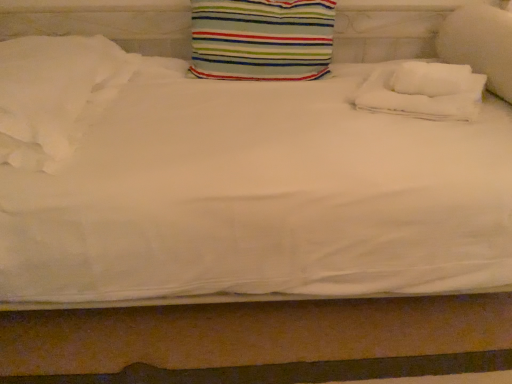
At what (x,y) coordinates should I click in order to perform the action: click on striped fabric pillow at center, positioned as the third pillow in right-to-left order. Please return your answer as a coordinate pair (x, y). This screenshot has height=384, width=512. Looking at the image, I should click on (x=261, y=39).

The image size is (512, 384). What do you see at coordinates (55, 95) in the screenshot?
I see `white soft pillow at left, placed as the 1th pillow when sorted from left to right` at bounding box center [55, 95].

At what (x,y) coordinates should I click in order to perform the action: click on white soft towel at upper right, the 3th pillow when ordered from left to right. Please return your answer as a coordinate pair (x, y). Looking at the image, I should click on (423, 91).

What is the approximate height of white soft pillow at right, which is the 1th pillow in right-to-left order?

It is 11.79 inches.

This screenshot has width=512, height=384. In order to click on white soft pillow at right, which is the 1th pillow in right-to-left order in this screenshot , I will do `click(480, 44)`.

I want to click on striped fabric pillow at center, the second pillow positioned from the left, so click(x=261, y=39).

Is white soft pillow at right, which is the 1th pillow in right-to-left order, positioned far away from striped fabric pillow at center, positioned as the third pillow in right-to-left order?

That's not correct — white soft pillow at right, which is the 1th pillow in right-to-left order, is a little close to striped fabric pillow at center, positioned as the third pillow in right-to-left order.

Can you confirm if white soft pillow at right, which is the 1th pillow in right-to-left order, is taller than striped fabric pillow at center, positioned as the third pillow in right-to-left order?

Indeed, white soft pillow at right, which is the 1th pillow in right-to-left order, has a greater height compared to striped fabric pillow at center, positioned as the third pillow in right-to-left order.

There is a striped fabric pillow at center, the second pillow positioned from the left. Identify the location of the 1st pillow below it (from the image's perspective). The image size is (512, 384). (480, 44).

Can you confirm if white soft pillow at right, which is the 1th pillow in right-to-left order, is bigger than striped fabric pillow at center, positioned as the third pillow in right-to-left order?

Yes, white soft pillow at right, which is the 1th pillow in right-to-left order, is bigger than striped fabric pillow at center, positioned as the third pillow in right-to-left order.

From a real-world perspective, relative to white soft towel at upper right, the 3th pillow when ordered from left to right, is white soft pillow at left, which is the fourth pillow in right-to-left order, vertically above or below?

white soft pillow at left, which is the fourth pillow in right-to-left order, is situated higher than white soft towel at upper right, the 3th pillow when ordered from left to right, in the real world.

What's the angular difference between white soft pillow at left, placed as the 1th pillow when sorted from left to right, and white soft towel at upper right, the 3th pillow when ordered from left to right,'s facing directions?

The angle between the facing direction of white soft pillow at left, placed as the 1th pillow when sorted from left to right, and the facing direction of white soft towel at upper right, the 3th pillow when ordered from left to right, is 8.18e-05 degrees.

Image resolution: width=512 pixels, height=384 pixels. I want to click on the 2nd pillow in front of the white soft towel at upper right, marked as the second pillow in a right-to-left arrangement, so click(x=55, y=95).

Does white soft pillow at left, which is the fourth pillow in right-to-left order, turn towards white soft towel at upper right, the 3th pillow when ordered from left to right?

No.

Is white soft towel at upper right, the 3th pillow when ordered from left to right, turned away from white soft pillow at right, which is the 1th pillow in right-to-left order?

No, white soft towel at upper right, the 3th pillow when ordered from left to right, is not facing the opposite direction of white soft pillow at right, which is the 1th pillow in right-to-left order.

Which of these two, white soft towel at upper right, marked as the second pillow in a right-to-left arrangement, or white soft pillow at right, which is the 1th pillow in right-to-left order, is wider?

With larger width is white soft pillow at right, which is the 1th pillow in right-to-left order.

Considering the positions of objects white soft towel at upper right, marked as the second pillow in a right-to-left arrangement, and white soft pillow at right, placed as the 4th pillow when sorted from left to right, in the image provided, who is behind, white soft towel at upper right, marked as the second pillow in a right-to-left arrangement, or white soft pillow at right, placed as the 4th pillow when sorted from left to right,?

white soft towel at upper right, marked as the second pillow in a right-to-left arrangement.

Is point (475, 97) positioned in front of point (448, 49)?

Yes, point (475, 97) is closer to viewer.

Considering the sizes of objects striped fabric pillow at center, positioned as the third pillow in right-to-left order, and white soft towel at upper right, marked as the second pillow in a right-to-left arrangement, in the image provided, who is thinner, striped fabric pillow at center, positioned as the third pillow in right-to-left order, or white soft towel at upper right, marked as the second pillow in a right-to-left arrangement,?

Thinner between the two is striped fabric pillow at center, positioned as the third pillow in right-to-left order.

How distant is striped fabric pillow at center, positioned as the third pillow in right-to-left order, from white soft towel at upper right, marked as the second pillow in a right-to-left arrangement?

striped fabric pillow at center, positioned as the third pillow in right-to-left order, and white soft towel at upper right, marked as the second pillow in a right-to-left arrangement, are 16.99 inches apart from each other.

How different are the orientations of striped fabric pillow at center, the second pillow positioned from the left, and white soft towel at upper right, the 3th pillow when ordered from left to right, in degrees?

The angular difference between striped fabric pillow at center, the second pillow positioned from the left, and white soft towel at upper right, the 3th pillow when ordered from left to right, is 2.56 degrees.

Based on their positions, is striped fabric pillow at center, the second pillow positioned from the left, located to the left or right of white soft towel at upper right, the 3th pillow when ordered from left to right?

Clearly, striped fabric pillow at center, the second pillow positioned from the left, is on the left of white soft towel at upper right, the 3th pillow when ordered from left to right, in the image.

From the image's perspective, does striped fabric pillow at center, the second pillow positioned from the left, appear higher than white soft pillow at left, which is the fourth pillow in right-to-left order?

Correct, striped fabric pillow at center, the second pillow positioned from the left, appears higher than white soft pillow at left, which is the fourth pillow in right-to-left order, in the image.

Does point (209, 77) come in front of point (60, 160)?

No, it is behind (60, 160).

Is striped fabric pillow at center, the second pillow positioned from the left, oriented towards white soft pillow at left, placed as the 1th pillow when sorted from left to right?

No, striped fabric pillow at center, the second pillow positioned from the left, is not turned towards white soft pillow at left, placed as the 1th pillow when sorted from left to right.

Which is correct: striped fabric pillow at center, the second pillow positioned from the left, is inside white soft pillow at left, placed as the 1th pillow when sorted from left to right, or outside of it?

striped fabric pillow at center, the second pillow positioned from the left, lies outside white soft pillow at left, placed as the 1th pillow when sorted from left to right.

Is white soft towel at upper right, the 3th pillow when ordered from left to right, outside of striped fabric pillow at center, positioned as the third pillow in right-to-left order?

Yes, white soft towel at upper right, the 3th pillow when ordered from left to right, is outside of striped fabric pillow at center, positioned as the third pillow in right-to-left order.

Can you confirm if white soft towel at upper right, marked as the second pillow in a right-to-left arrangement, is wider than striped fabric pillow at center, the second pillow positioned from the left?

Yes, white soft towel at upper right, marked as the second pillow in a right-to-left arrangement, is wider than striped fabric pillow at center, the second pillow positioned from the left.

From the image's perspective, is white soft towel at upper right, marked as the second pillow in a right-to-left arrangement, located beneath striped fabric pillow at center, the second pillow positioned from the left?

Correct, white soft towel at upper right, marked as the second pillow in a right-to-left arrangement, appears lower than striped fabric pillow at center, the second pillow positioned from the left, in the image.

From a real-world perspective, is white soft pillow at left, placed as the 1th pillow when sorted from left to right, positioned under white soft pillow at right, which is the 1th pillow in right-to-left order, based on gravity?

Yes, from a real-world perspective, white soft pillow at left, placed as the 1th pillow when sorted from left to right, is beneath white soft pillow at right, which is the 1th pillow in right-to-left order.

Are white soft pillow at left, which is the fourth pillow in right-to-left order, and white soft pillow at right, placed as the 4th pillow when sorted from left to right, located far from each other?

Absolutely, white soft pillow at left, which is the fourth pillow in right-to-left order, is distant from white soft pillow at right, placed as the 4th pillow when sorted from left to right.

In terms of height, does white soft pillow at left, placed as the 1th pillow when sorted from left to right, look taller or shorter compared to white soft pillow at right, placed as the 4th pillow when sorted from left to right?

Clearly, white soft pillow at left, placed as the 1th pillow when sorted from left to right, is shorter compared to white soft pillow at right, placed as the 4th pillow when sorted from left to right.

Is white soft pillow at left, placed as the 1th pillow when sorted from left to right, positioned in front of white soft pillow at right, placed as the 4th pillow when sorted from left to right?

Yes, white soft pillow at left, placed as the 1th pillow when sorted from left to right, is in front of white soft pillow at right, placed as the 4th pillow when sorted from left to right.

From the white soft pillow at right, which is the 1th pillow in right-to-left order, count 2nd pillows backward and point to it. Please provide its 2D coordinates.

[(261, 39)]

From the image's perspective, starting from the white soft pillow at left, which is the fourth pillow in right-to-left order, which pillow is the 1st one above? Please provide its 2D coordinates.

[(423, 91)]

When comparing their distances from white soft pillow at left, placed as the 1th pillow when sorted from left to right, does white soft towel at upper right, the 3th pillow when ordered from left to right, or striped fabric pillow at center, the second pillow positioned from the left, seem closer?

striped fabric pillow at center, the second pillow positioned from the left, is positioned closer to the anchor white soft pillow at left, placed as the 1th pillow when sorted from left to right.

From the image, which object appears to be farther from white soft pillow at left, placed as the 1th pillow when sorted from left to right, white soft pillow at right, which is the 1th pillow in right-to-left order, or striped fabric pillow at center, the second pillow positioned from the left?

Based on the image, white soft pillow at right, which is the 1th pillow in right-to-left order, appears to be further to white soft pillow at left, placed as the 1th pillow when sorted from left to right.

Estimate the real-world distances between objects in this image. Which object is closer to white soft pillow at left, which is the fourth pillow in right-to-left order, striped fabric pillow at center, the second pillow positioned from the left, or white soft towel at upper right, marked as the second pillow in a right-to-left arrangement?

Among the two, striped fabric pillow at center, the second pillow positioned from the left, is located nearer to white soft pillow at left, which is the fourth pillow in right-to-left order.

When comparing their distances from white soft pillow at right, which is the 1th pillow in right-to-left order, does white soft pillow at left, placed as the 1th pillow when sorted from left to right, or striped fabric pillow at center, the second pillow positioned from the left, seem closer?

striped fabric pillow at center, the second pillow positioned from the left.

Based on the photo, looking at the image, which one is located closer to striped fabric pillow at center, the second pillow positioned from the left, white soft pillow at left, which is the fourth pillow in right-to-left order, or white soft pillow at right, which is the 1th pillow in right-to-left order?

Among the two, white soft pillow at left, which is the fourth pillow in right-to-left order, is located nearer to striped fabric pillow at center, the second pillow positioned from the left.

When comparing their distances from striped fabric pillow at center, positioned as the third pillow in right-to-left order, does white soft pillow at right, placed as the 4th pillow when sorted from left to right, or white soft pillow at left, placed as the 1th pillow when sorted from left to right, seem further?

Based on the image, white soft pillow at right, placed as the 4th pillow when sorted from left to right, appears to be further to striped fabric pillow at center, positioned as the third pillow in right-to-left order.

From the image, which object appears to be farther from white soft pillow at right, placed as the 4th pillow when sorted from left to right, white soft pillow at left, which is the fourth pillow in right-to-left order, or white soft towel at upper right, the 3th pillow when ordered from left to right?

white soft pillow at left, which is the fourth pillow in right-to-left order, is positioned further to the anchor white soft pillow at right, placed as the 4th pillow when sorted from left to right.

Looking at the image, which one is located further to white soft pillow at left, placed as the 1th pillow when sorted from left to right, white soft pillow at right, which is the 1th pillow in right-to-left order, or white soft towel at upper right, the 3th pillow when ordered from left to right?

white soft pillow at right, which is the 1th pillow in right-to-left order.

Identify the location of pillow between white soft pillow at left, placed as the 1th pillow when sorted from left to right, and white soft towel at upper right, marked as the second pillow in a right-to-left arrangement, in the horizontal direction. (261, 39).

You are a GUI agent. You are given a task and a screenshot of the screen. Output one action in this format:
    pyautogui.click(x=<x>, y=<y>)
    Task: Click on the pillow between striped fabric pillow at center, the second pillow positioned from the left, and white soft pillow at right, placed as the 4th pillow when sorted from left to right
    This screenshot has width=512, height=384.
    Given the screenshot: What is the action you would take?
    pyautogui.click(x=423, y=91)